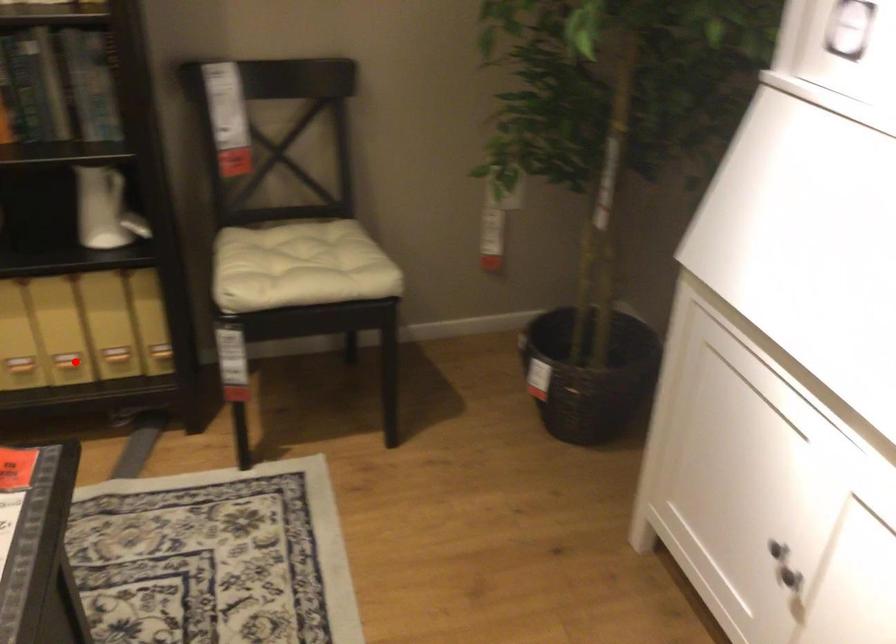
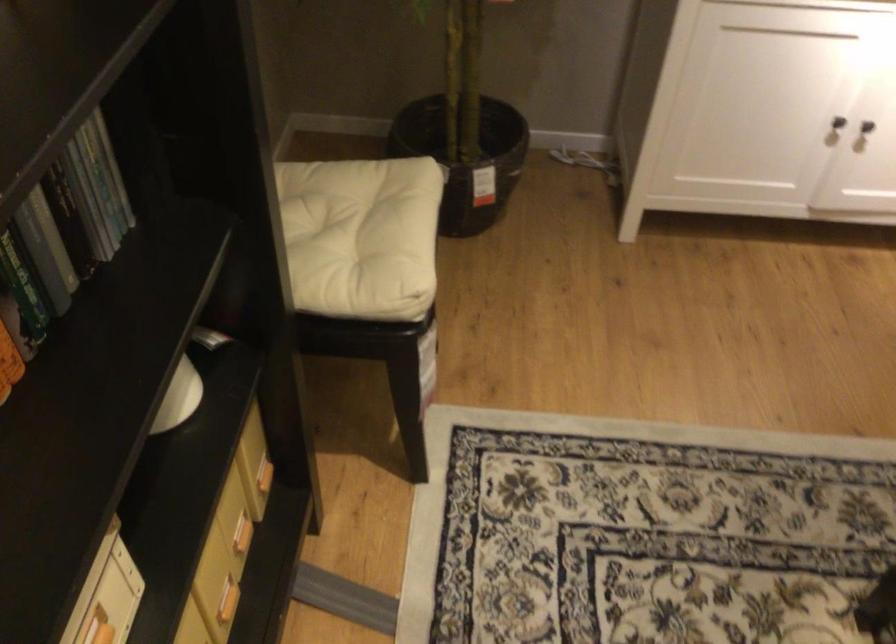
Question: I am providing you with two images of the same scene from different viewpoints. Image1 has a red point marked. In image2, the corresponding 3D location appears at what relative position? Reply with the corresponding letter.

Choices:
 (A) Closer
 (B) Farther

Answer: (A)